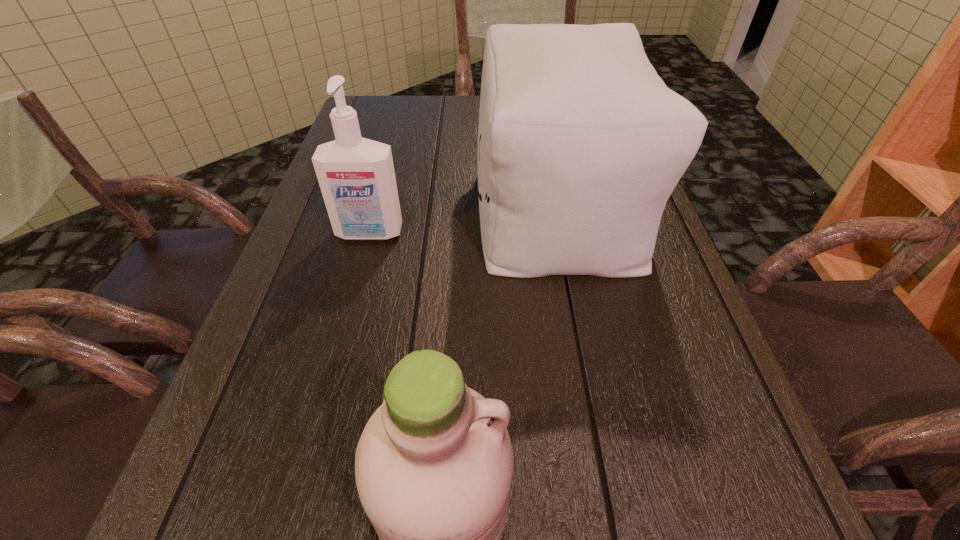
Locate an element on the screen. free space in the image that satisfies the following two spatial constraints: 1. on the side of the cushion with the smiley face; 2. on the front label of the leftmost object is located at coordinates 562,233.

At what (x,y) coordinates should I click in order to perform the action: click on vacant space that satisfies the following two spatial constraints: 1. on the side of the cushion with the smiley face; 2. on the front label of the left cleansing agent. Please return your answer as a coordinate pair (x, y). Looking at the image, I should click on 562,233.